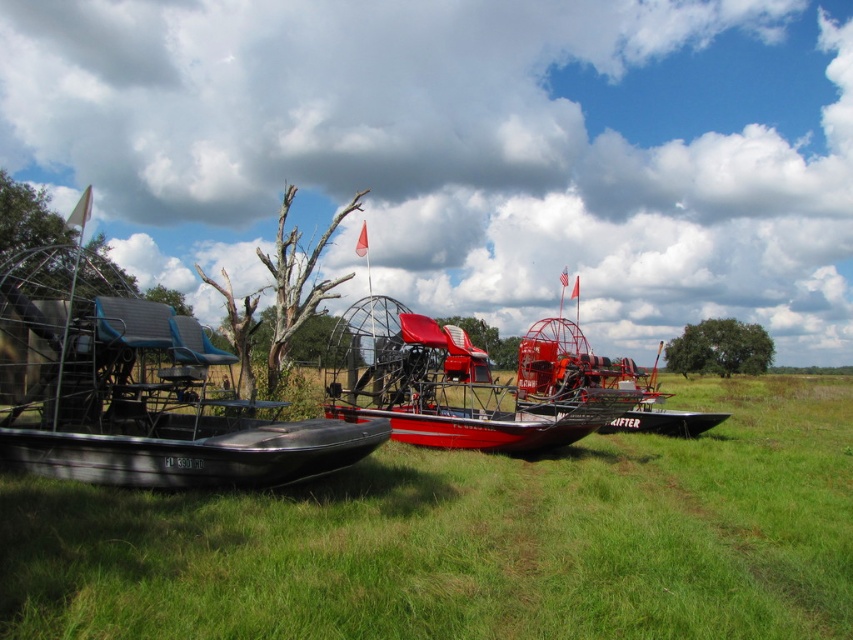
Question: Which of the following is the closest to the observer?

Choices:
 (A) pyautogui.click(x=355, y=380)
 (B) pyautogui.click(x=238, y=417)
 (C) pyautogui.click(x=405, y=616)

Answer: (C)

Question: Which of the following is the farthest from the observer?

Choices:
 (A) green grass at lower left
 (B) black matte airboat at left

Answer: (B)

Question: From the image, what is the correct spatial relationship of black matte airboat at left in relation to red matte airboat at center?

Choices:
 (A) above
 (B) below

Answer: (A)

Question: Does green grass at lower left appear on the right side of red matte airboat at center?

Choices:
 (A) yes
 (B) no

Answer: (A)

Question: Which of the following is the farthest from the observer?

Choices:
 (A) (189, 486)
 (B) (782, 545)
 (C) (491, 394)

Answer: (C)

Question: Does green grass at lower left appear on the left side of black matte airboat at left?

Choices:
 (A) no
 (B) yes

Answer: (A)